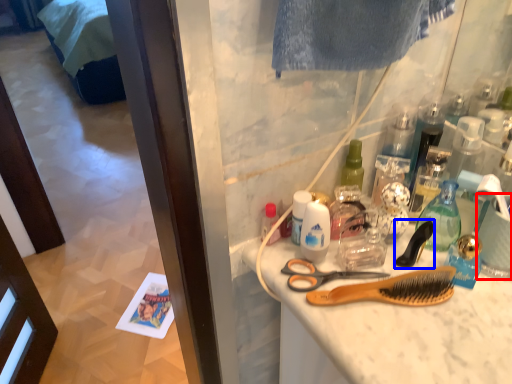
Question: Which object appears closest to the camera in this image, coffee cup (highlighted by a red box) or brush (highlighted by a blue box)?

Choices:
 (A) coffee cup
 (B) brush

Answer: (A)